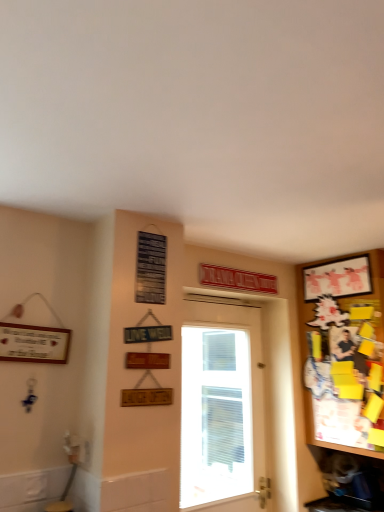
Question: From the image's perspective, is matte white picture frame at upper right positioned above or below wooden bulletin board at right?

Choices:
 (A) below
 (B) above

Answer: (B)

Question: Would you say matte white picture frame at upper right is to the left or to the right of wooden bulletin board at right in the picture?

Choices:
 (A) left
 (B) right

Answer: (A)

Question: Which is nearer to the white glossy door at center?

Choices:
 (A) wooden bulletin board at right
 (B) matte white picture frame at upper right

Answer: (A)

Question: Which object is positioned closest to the white glossy door at center?

Choices:
 (A) wooden bulletin board at right
 (B) matte white picture frame at upper right

Answer: (A)